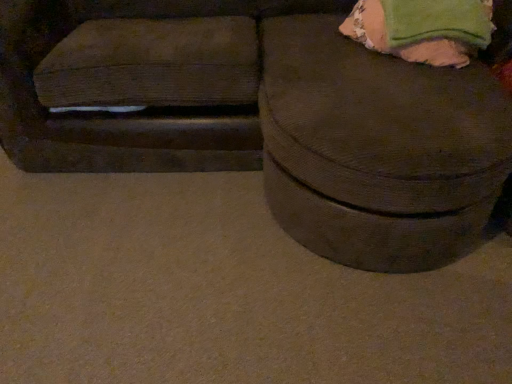
Question: Is brown corduroy ottoman at center taller or shorter than green fabric bean bag at upper right?

Choices:
 (A) tall
 (B) short

Answer: (A)

Question: Considering the positions of brown corduroy ottoman at center and green fabric bean bag at upper right in the image, is brown corduroy ottoman at center wider or thinner than green fabric bean bag at upper right?

Choices:
 (A) thin
 (B) wide

Answer: (B)

Question: Based on their sizes in the image, would you say brown corduroy ottoman at center is bigger or smaller than green fabric bean bag at upper right?

Choices:
 (A) big
 (B) small

Answer: (A)

Question: From a real-world perspective, is green fabric bean bag at upper right above or below brown corduroy ottoman at center?

Choices:
 (A) below
 (B) above

Answer: (B)

Question: Considering the positions of green fabric bean bag at upper right and brown corduroy ottoman at center in the image, is green fabric bean bag at upper right bigger or smaller than brown corduroy ottoman at center?

Choices:
 (A) big
 (B) small

Answer: (B)

Question: In the image, is green fabric bean bag at upper right positioned in front of or behind brown corduroy ottoman at center?

Choices:
 (A) behind
 (B) front

Answer: (A)

Question: From the image's perspective, is green fabric bean bag at upper right positioned above or below brown corduroy ottoman at center?

Choices:
 (A) below
 (B) above

Answer: (B)